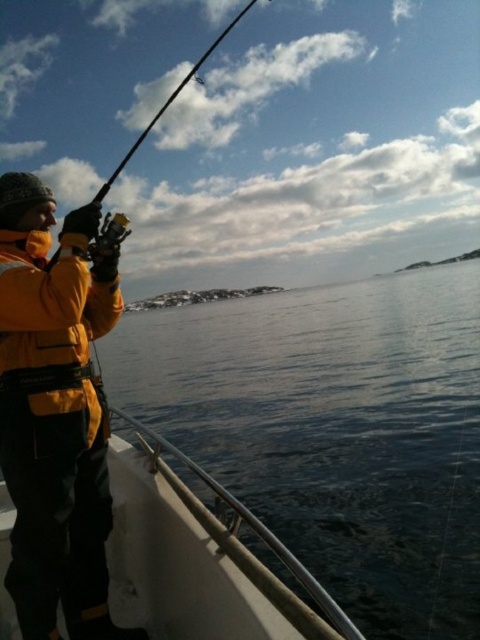
Question: Estimate the real-world distances between objects in this image. Which object is closer to the yellow matte jacket at left?

Choices:
 (A) transparent water at lower center
 (B) white matte boat at lower left

Answer: (B)

Question: Is transparent water at lower center smaller than yellow matte jacket at left?

Choices:
 (A) no
 (B) yes

Answer: (A)

Question: Does yellow matte jacket at left have a lesser width compared to white matte boat at lower left?

Choices:
 (A) yes
 (B) no

Answer: (B)

Question: Among these objects, which one is nearest to the camera?

Choices:
 (A) transparent water at lower center
 (B) white matte boat at lower left
 (C) yellow matte jacket at left

Answer: (B)

Question: Is yellow matte jacket at left in front of white matte boat at lower left?

Choices:
 (A) yes
 (B) no

Answer: (B)

Question: Among these points, which one is farthest from the camera?

Choices:
 (A) (287, 330)
 (B) (98, 541)
 (C) (300, 573)

Answer: (A)